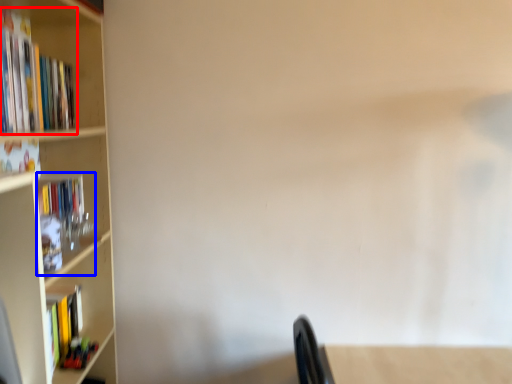
Question: Which point is closer to the camera, book (highlighted by a red box) or book (highlighted by a blue box)?

Choices:
 (A) book
 (B) book

Answer: (A)